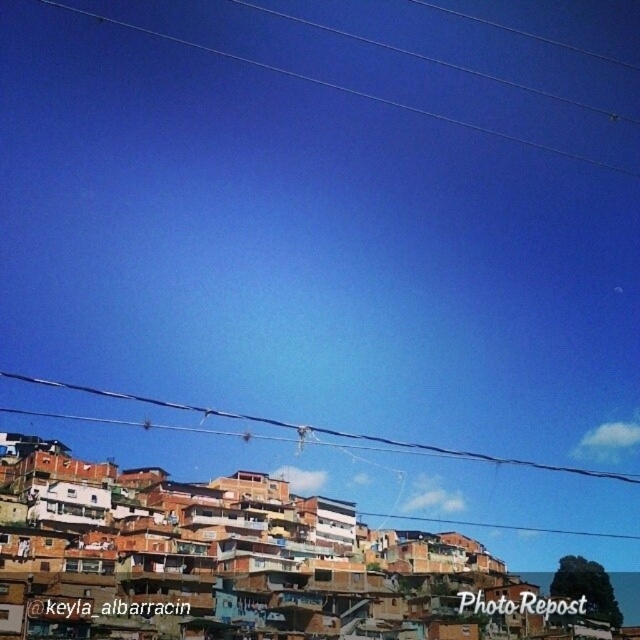
You are a city planner analyzing the urban landscape. You notice the black wire at upper center and the clear plastic wires at upper center. Which of these two wires is positioned closer to the observer?

The black wire at upper center is closer to the viewer than the clear plastic wires at upper center.

You are standing at the point marked as point (x=205, y=545) in the image. Looking around, you see the brown wooden houses at lower center. Which direction should you face to see the brown wooden houses at lower center?

You should face towards the direction of the brown wooden houses at lower center because they are located exactly at the point (x=205, y=545) where you are standing.

You are standing at the base of a steep hillside where the brown wooden houses at lower center are located. You want to climb up to the highest point of the hillside. Considering the distance mentioned, is this a short walk or a long hike?

The distance between you and the brown wooden houses at lower center is 90.90 meters. Since this is a steep hillside with tightly packed buildings, climbing 90.90 meters would likely be considered a moderate hike requiring some effort, not just a short walk.